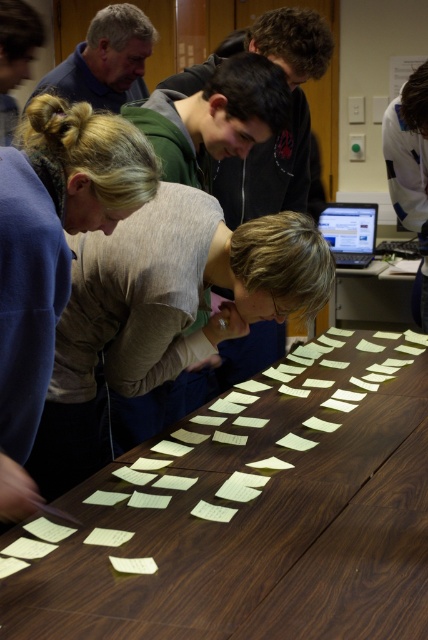
Question: Among these points, which one is farthest from the camera?

Choices:
 (A) (58, 84)
 (B) (11, 291)

Answer: (A)

Question: Can you confirm if brown wood table at center is bigger than gray sweater at center?

Choices:
 (A) no
 (B) yes

Answer: (B)

Question: Which point appears closest to the camera in this image?

Choices:
 (A) (56, 168)
 (B) (413, 294)
 (C) (175, 500)
 (D) (6, 72)

Answer: (A)

Question: From the image, what is the correct spatial relationship of brown wood table at center in relation to matte blue sweater at upper left?

Choices:
 (A) below
 (B) above

Answer: (A)

Question: Which point is closer to the camera taking this photo?

Choices:
 (A) (413, 310)
 (B) (23, 499)

Answer: (B)

Question: Where is white lab coat at upper right located in relation to blonde hair at upper left in the image?

Choices:
 (A) right
 (B) left

Answer: (A)